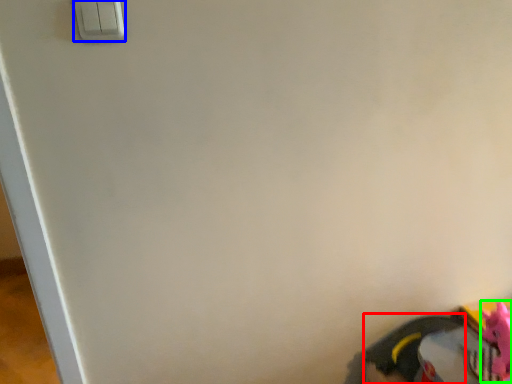
Question: Which object is the closest to the footwear (highlighted by a red box)? Choose among these: light switch (highlighted by a blue box) or toy (highlighted by a green box).

Choices:
 (A) light switch
 (B) toy

Answer: (B)